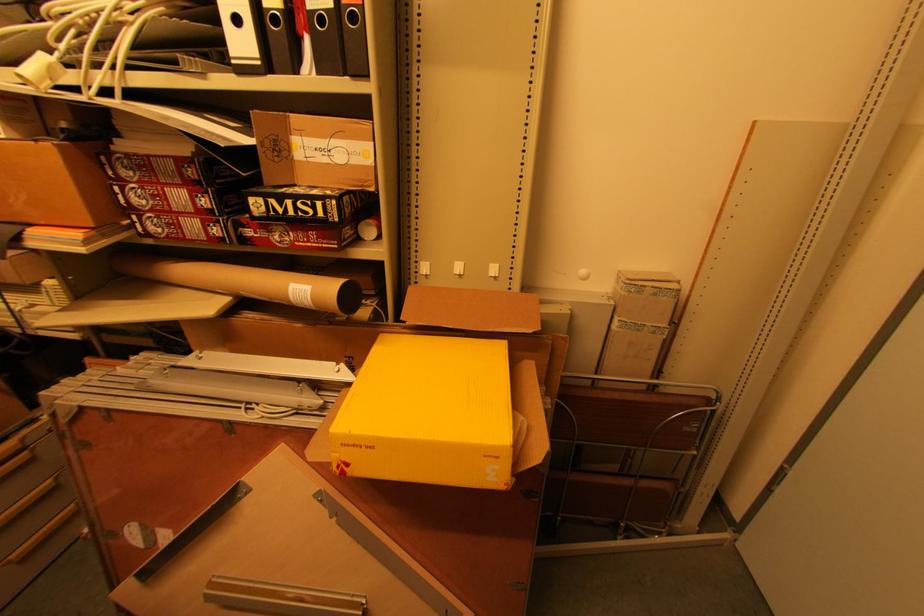
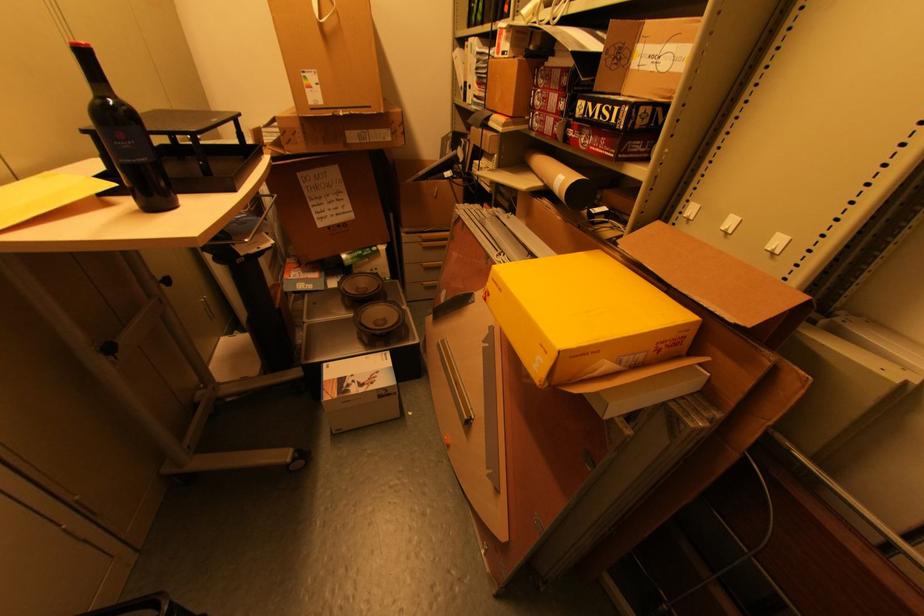
Where in the second image is the point corresponding to (307,204) from the first image?

(610, 108)